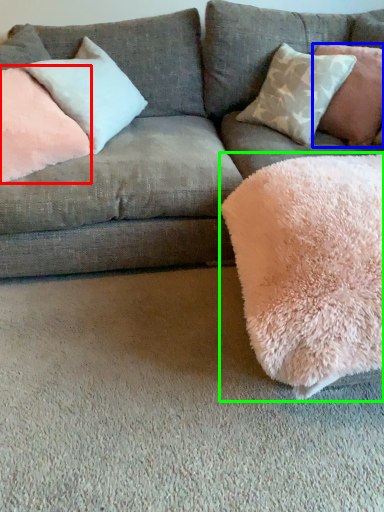
Question: Which is farther away from pillow (highlighted by a red box)? pillow (highlighted by a blue box) or blanket (highlighted by a green box)?

Choices:
 (A) pillow
 (B) blanket

Answer: (A)